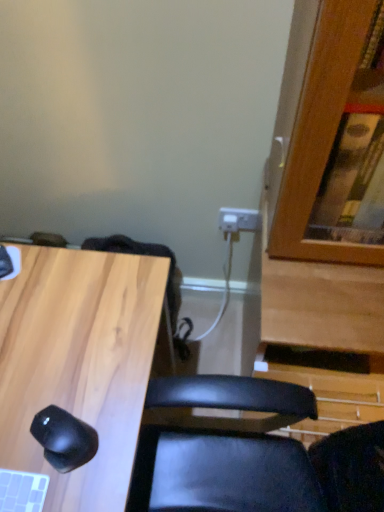
Question: Is black matte mouse at lower left taller or shorter than light wood/black mouse at lower left?

Choices:
 (A) tall
 (B) short

Answer: (B)

Question: In terms of width, does black matte mouse at lower left look wider or thinner when compared to light wood/black mouse at lower left?

Choices:
 (A) thin
 (B) wide

Answer: (A)

Question: From the image's perspective, is black matte mouse at lower left located above or below light wood/black mouse at lower left?

Choices:
 (A) above
 (B) below

Answer: (A)

Question: Would you say light wood/black mouse at lower left is to the left or to the right of black matte mouse at lower left in the picture?

Choices:
 (A) left
 (B) right

Answer: (A)

Question: Considering the positions of light wood/black mouse at lower left and black matte mouse at lower left in the image, is light wood/black mouse at lower left taller or shorter than black matte mouse at lower left?

Choices:
 (A) short
 (B) tall

Answer: (B)

Question: Is point (87, 473) closer or farther from the camera than point (89, 459)?

Choices:
 (A) closer
 (B) farther

Answer: (A)

Question: Relative to black matte mouse at lower left, is light wood/black mouse at lower left in front or behind?

Choices:
 (A) behind
 (B) front

Answer: (B)